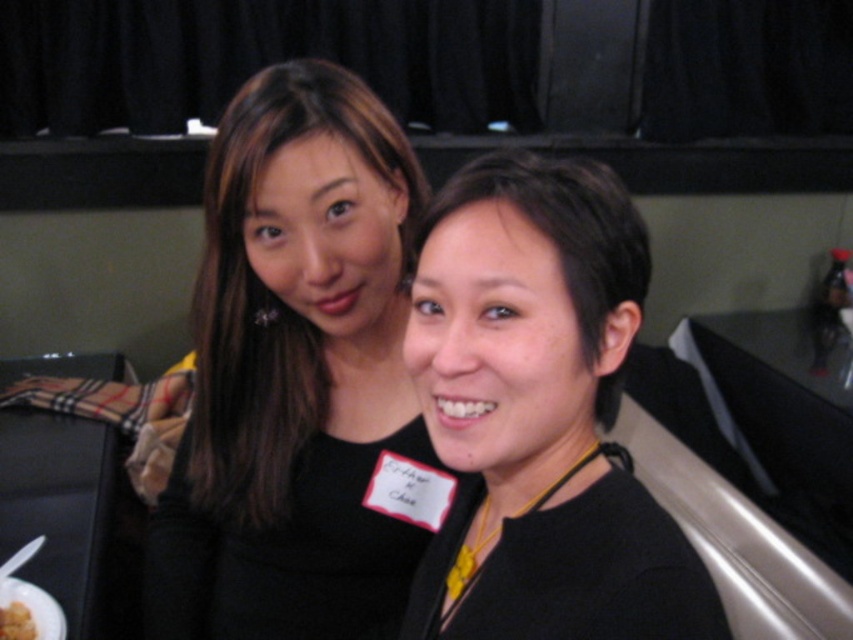
Question: Which is farther from the yellow matte food at lower left?

Choices:
 (A) black matte dress at center
 (B) black matte necklace at center
 (C) white matte plate at lower left

Answer: (B)

Question: Does black matte necklace at center appear on the right side of white matte plate at lower left?

Choices:
 (A) no
 (B) yes

Answer: (B)

Question: Is black matte dress at center smaller than white matte plate at lower left?

Choices:
 (A) no
 (B) yes

Answer: (A)

Question: Estimate the real-world distances between objects in this image. Which object is closer to the black matte dress at center?

Choices:
 (A) white matte plate at lower left
 (B) black matte necklace at center

Answer: (B)

Question: Is black matte dress at center positioned in front of white matte plate at lower left?

Choices:
 (A) no
 (B) yes

Answer: (B)

Question: Considering the real-world distances, which object is farthest from the black matte dress at center?

Choices:
 (A) white matte plate at lower left
 (B) black matte necklace at center
 (C) yellow matte food at lower left

Answer: (C)